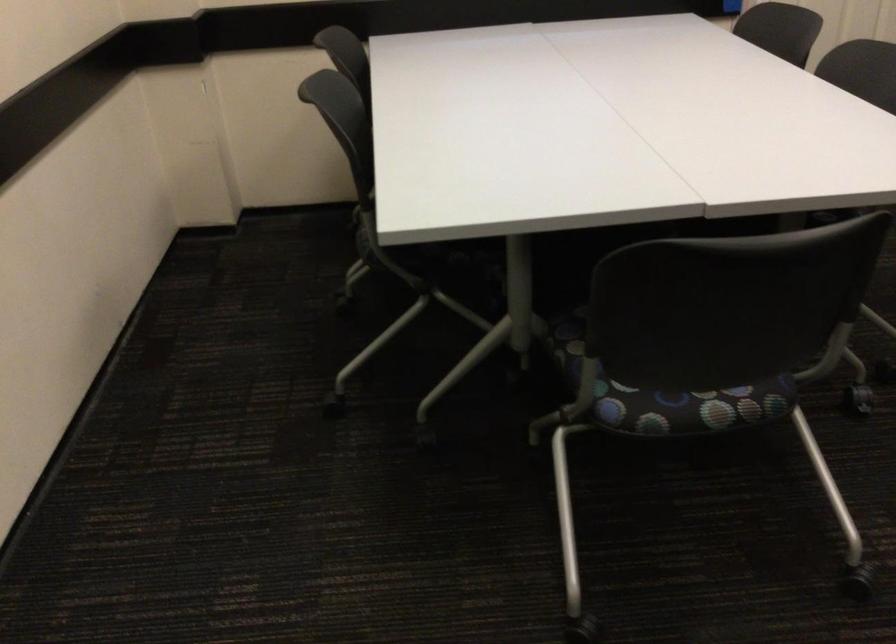
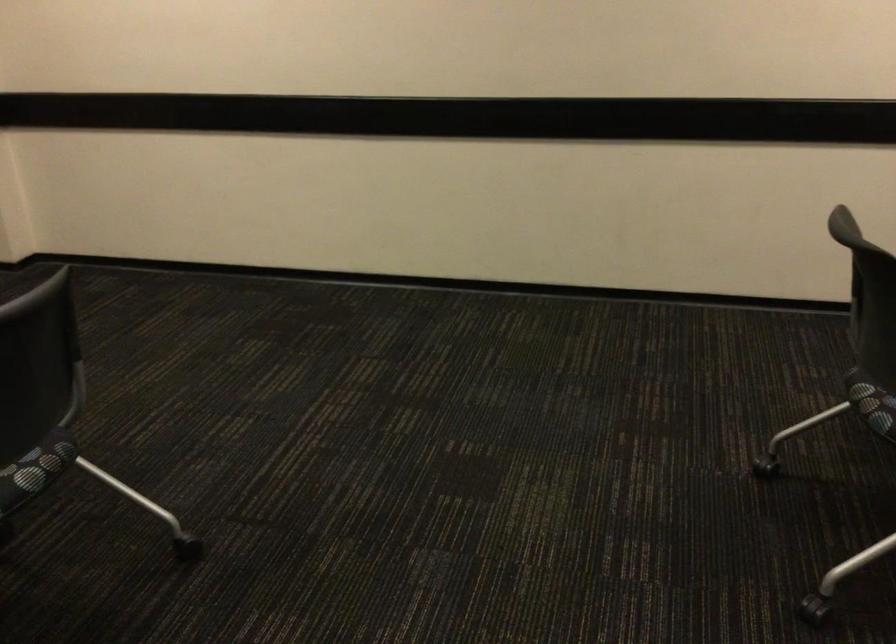
In the second image, find the point that corresponds to (x=729, y=418) in the first image.

(874, 408)